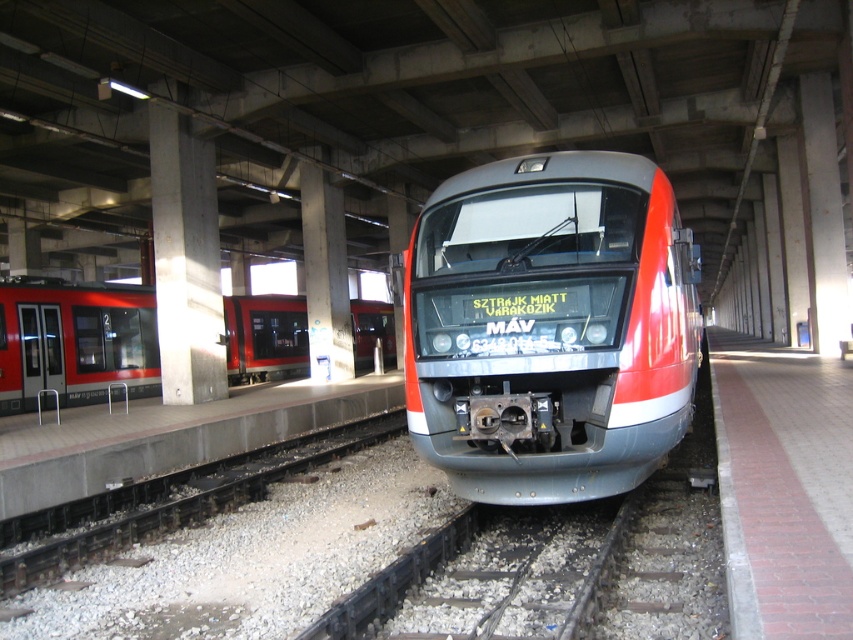
You are a passenger waiting at the train station. You see a metallic gray train at center and a matte red train at left. Which train is closer to you?

The metallic gray train at center is closer to you because it is in front of the matte red train at left.

You are a station engineer who needs to ensure that both trains can fit on the platform. Given that the platform is 10 meters wide, can both the metallic gray train at center and the matte red train at left be placed side by side without overlapping?

The metallic gray train at center is narrower than the matte red train at left. However, without knowing the exact widths of both trains, it is impossible to determine if their combined width exceeds the 10 meter platform. Additional measurements are required.